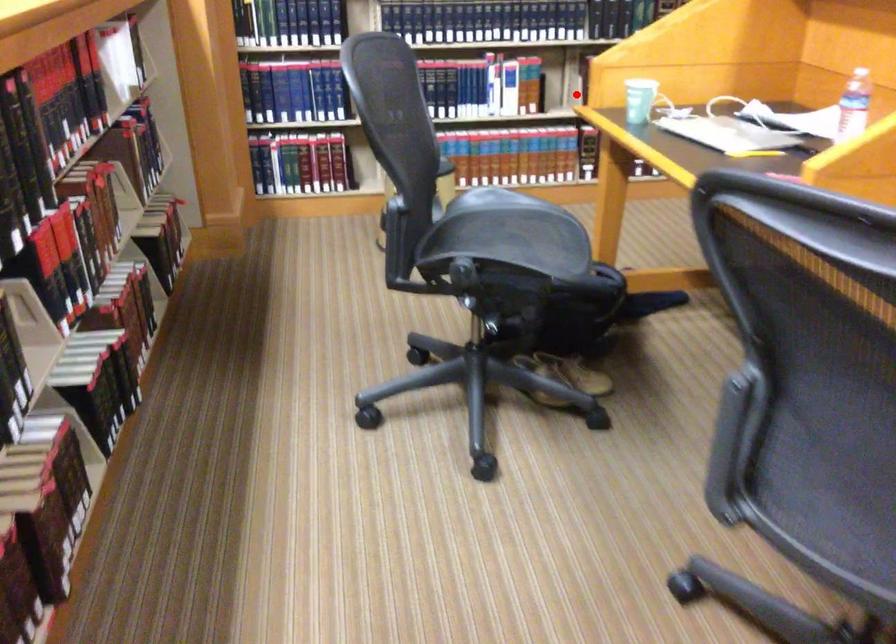
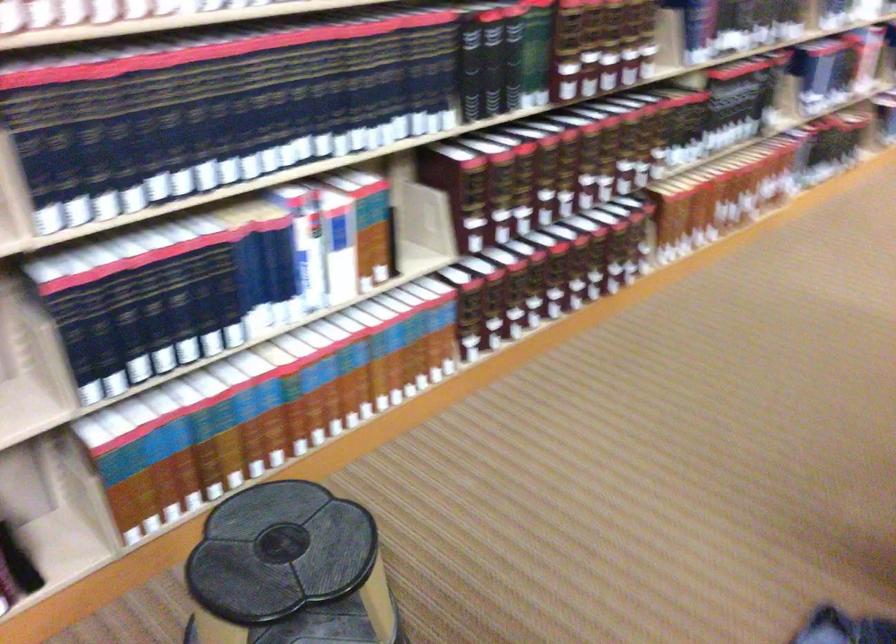
Question: I am providing you with two images of the same scene from different viewpoints. Image1 has a red point marked. In image2, the corresponding 3D location appears at what relative position? Reply with the corresponding letter.

Choices:
 (A) Closer
 (B) Farther

Answer: (A)